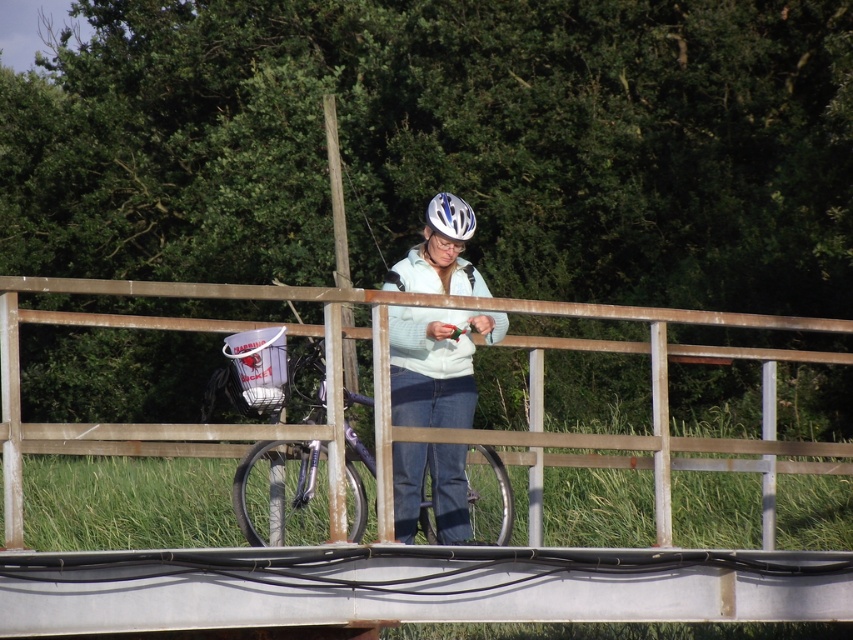
You are a delivery drone operator. Your drone must fly from the brown wooden rail at center to the white matte helmet at center. What is the minimum distance your drone needs to cover?

The minimum distance your drone needs to cover is 1.19 meters between brown wooden rail at center and white matte helmet at center.

You are a photographer trying to capture a clear shot of both the white matte helmet at center and the metallic purple bicycle at center. Since you want to ensure both are visible, which object should you focus on first to account for their positions?

You should focus on the metallic purple bicycle at center first because the white matte helmet at center is positioned to its right side, meaning the bicycle is closer to the photographer.